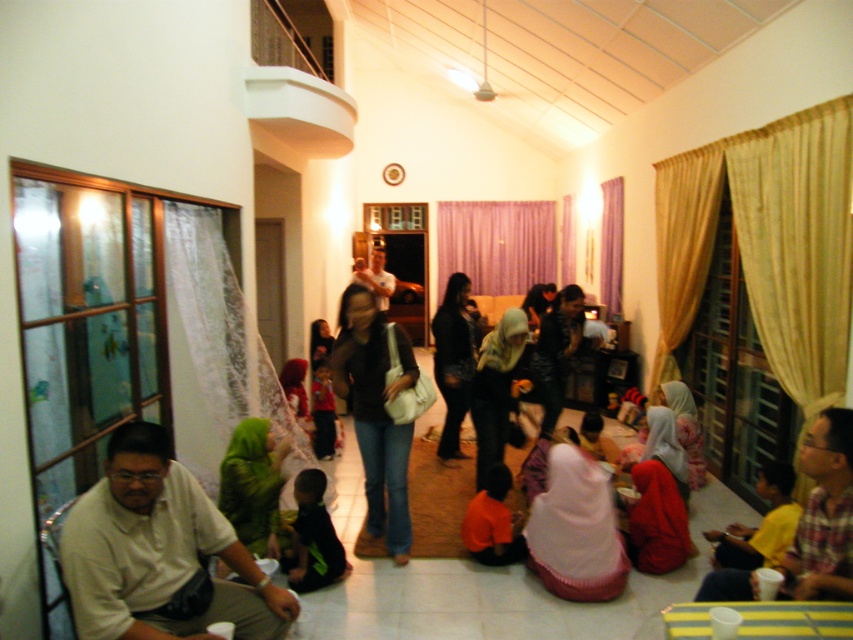
Does matte black shirt at center appear on the left side of black leather jacket at center?

Indeed, matte black shirt at center is positioned on the left side of black leather jacket at center.

Does matte black shirt at center appear under black leather jacket at center?

Indeed, matte black shirt at center is positioned under black leather jacket at center.

Who is more forward, (x=355, y=358) or (x=442, y=452)?

Point (x=355, y=358) is in front.

Find the location of `matte black shirt at center`. matte black shirt at center is located at coordinates (375, 413).

In the scene shown: Can you confirm if green fabric headscarf at center is wider than matte black hijab at center?

Indeed, green fabric headscarf at center has a greater width compared to matte black hijab at center.

Does green fabric headscarf at center appear under matte black hijab at center?

Indeed, green fabric headscarf at center is positioned under matte black hijab at center.

Identify the location of green fabric headscarf at center. pyautogui.click(x=253, y=484).

Which of these two, black leather jacket at center or black fabric shirt at lower center, stands taller?

With more height is black leather jacket at center.

Looking at this image, who is more distant from viewer, (463,360) or (334,573)?

Positioned behind is point (463,360).

You are a GUI agent. You are given a task and a screenshot of the screen. Output one action in this format:
    pyautogui.click(x=<x>, y=<y>)
    Task: Click on the black leather jacket at center
    The width and height of the screenshot is (853, 640).
    Given the screenshot: What is the action you would take?
    pyautogui.click(x=451, y=362)